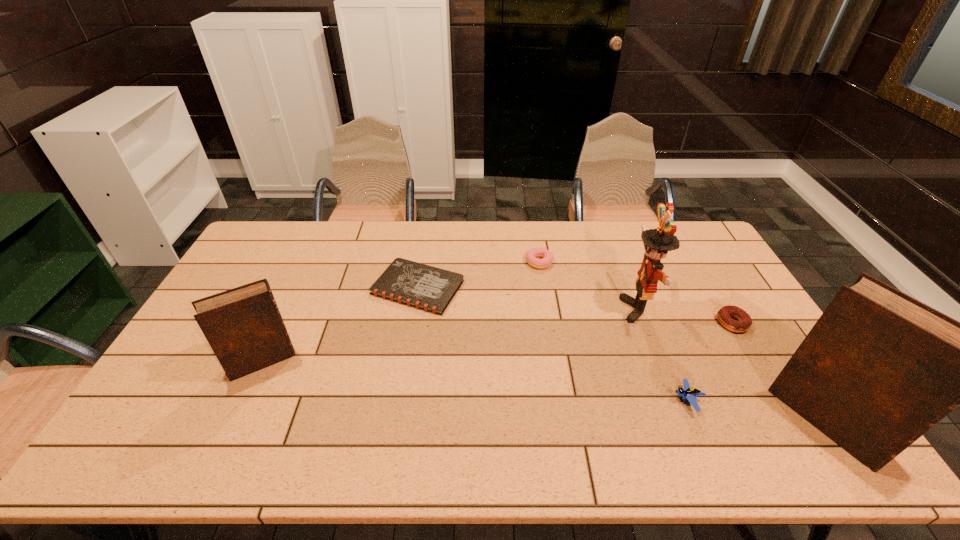
If we want them evenly spaced by inserting an extra Bible among them, please locate a free spot for this new Bible. Please provide its 2D coordinates. Your answer should be formatted as a tuple, i.e. [(x, y)], where the tuple contains the x and y coordinates of a point satisfying the conditions above.

[(527, 389)]